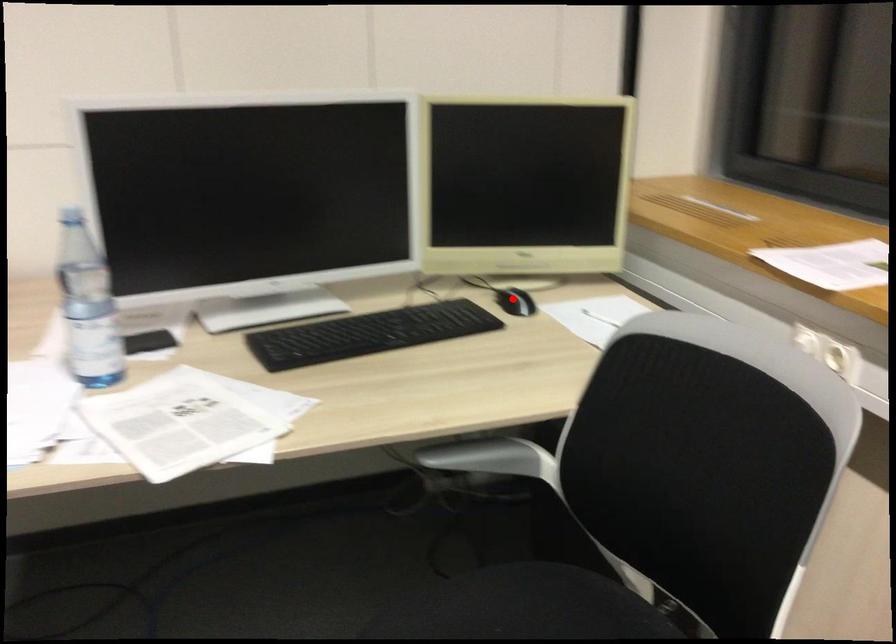
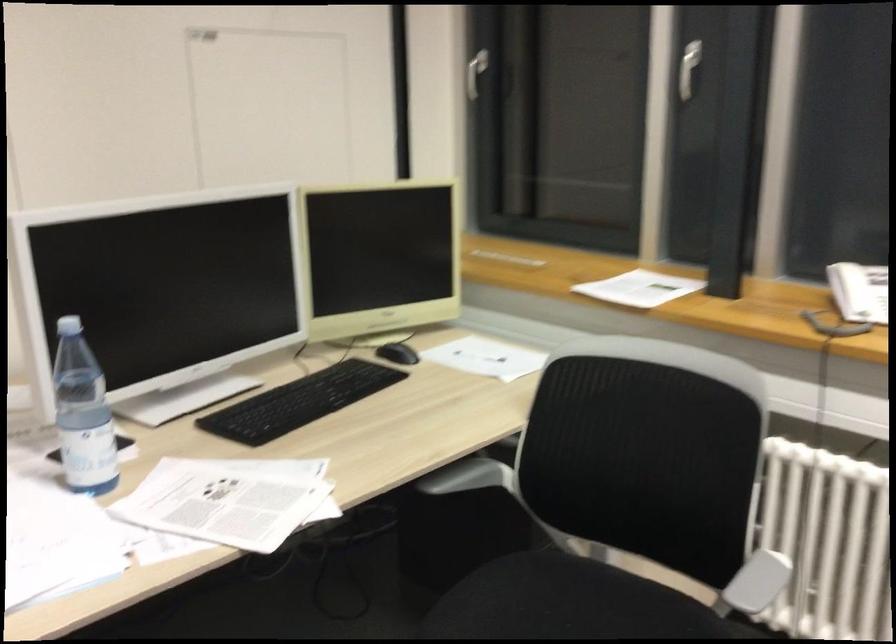
Locate, in the second image, the point that corresponds to the highlighted location in the first image.

(398, 353)